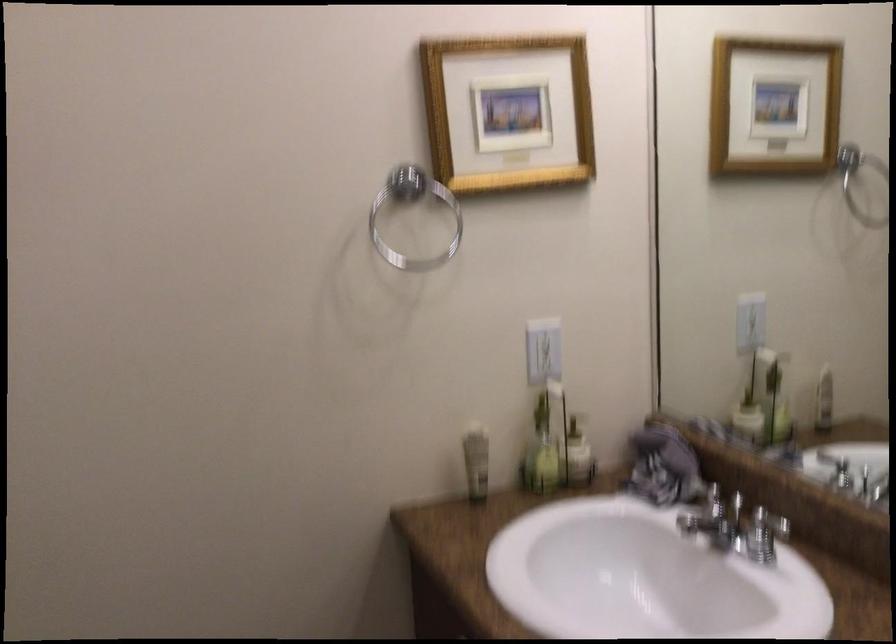
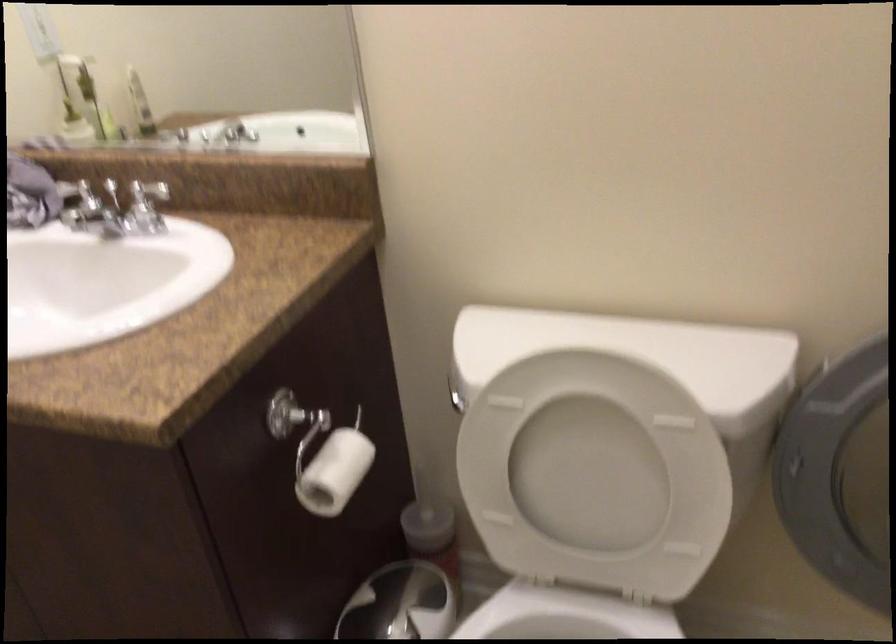
The point at (708, 464) is marked in the first image. Where is the corresponding point in the second image?

(64, 180)